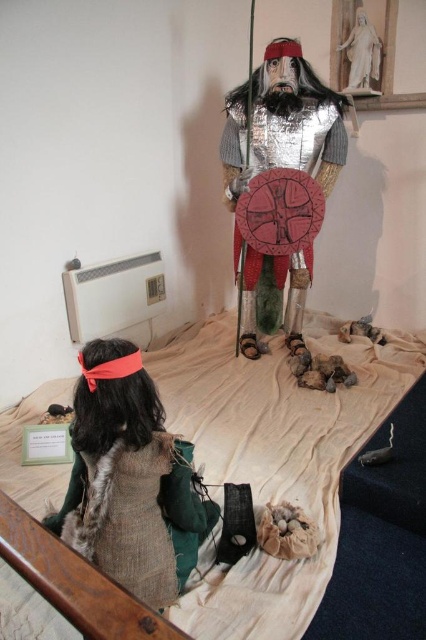
You are standing in the room and want to place a new decorative item. The point at coordinates (273, 458) is where you want to place it. What object is located at that point?

The point at coordinates (273, 458) corresponds to the white fabric bed at center.